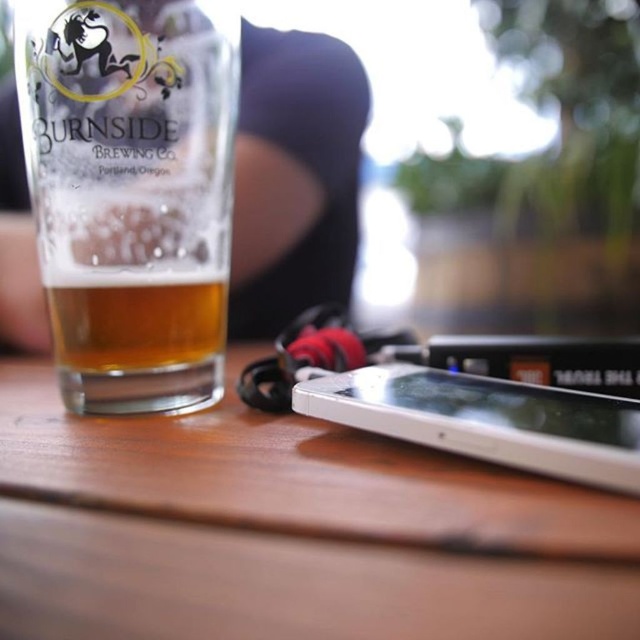
You are at a picnic and have a clear glass beer at left and a golden glass at center on the table. You need to choose a glass to hold. Which one has a wider diameter?

The clear glass beer at left has a wider diameter than the golden glass at center because the clear glass beer at left is wider than the golden glass at center.

You are a bartender who needs to place a 2.5 inches wide coaster between the clear glass beer at left and the golden glass at center. Is there enough space to fit the coaster between them?

The distance between the clear glass beer at left and the golden glass at center is 1.77 inches, which is less than the coaster width of 2.5 inches. Therefore, the coaster cannot fit between them.

You are standing at the edge of the table and want to place a small object on the wooden table at center. Given that the table is at coordinates 0.830, 0.452, where should you aim to place the object to ensure it lands on the table?

The wooden table at center is located at point (289, 531), so you should aim for those coordinates to place the object directly on the table.